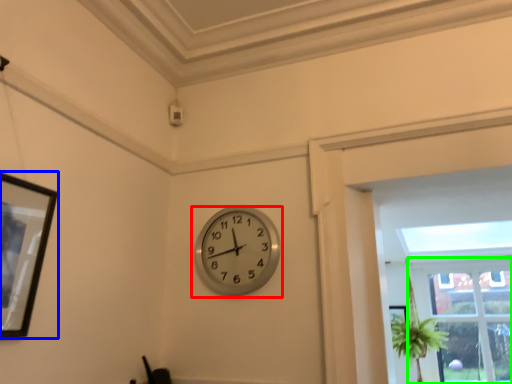
Question: Considering the real-world distances, which object is closest to wall clock (highlighted by a red box)? picture frame (highlighted by a blue box) or window (highlighted by a green box).

Choices:
 (A) picture frame
 (B) window

Answer: (A)